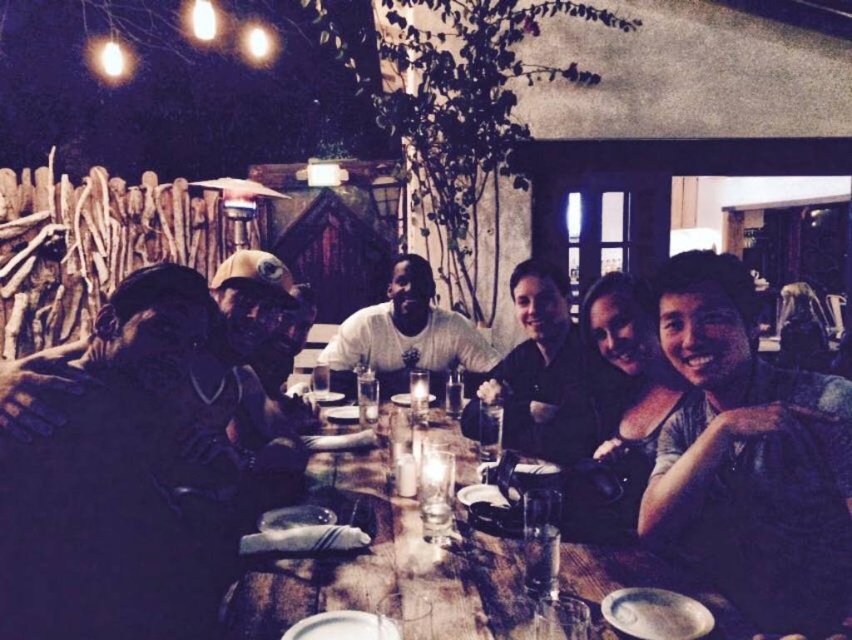
You are a photographer standing behind the camera at the edge of the dining area. You want to capture a photo that includes both the blue denim shirt at lower right and the black matte shirt at center. Given that your camera has a maximum focus range of 30 inches, will you be able to focus on both subjects simultaneously?

The blue denim shirt at lower right is 32.84 inches from the black matte shirt at center. Since the distance between them exceeds the camera maximum focus range of 30 inches, you will not be able to focus on both subjects simultaneously.

You are a photographer standing at the camera position. You want to take a photo of the dark matte jacket at left without moving the jacket. Is the jacket within your camera lens range of 5 feet?

The dark matte jacket at left and camera are 4.77 feet apart from each other, so yes, the jacket is within the camera lens range of 5 feet.